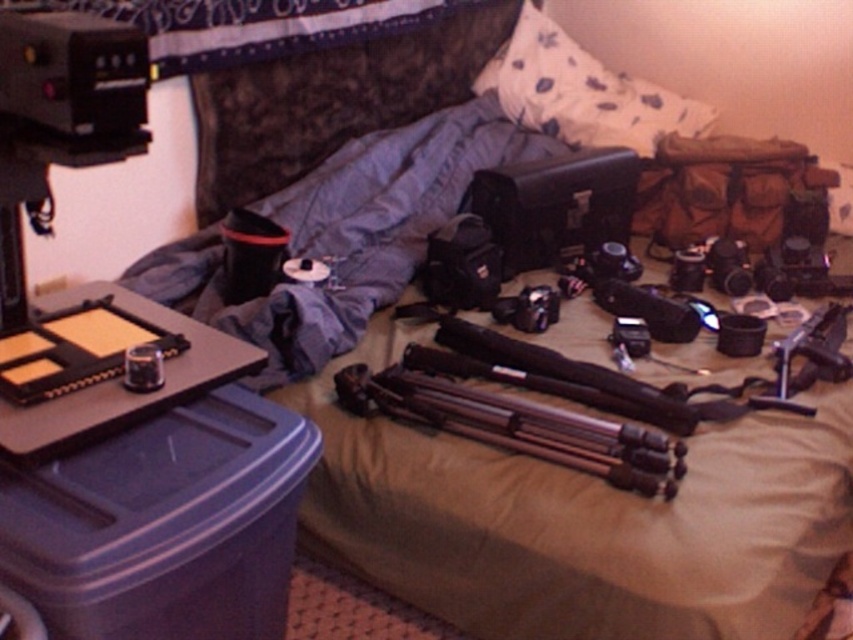
Does point (514, 432) come closer to viewer compared to point (548, 70)?

Yes, it is in front of point (548, 70).

Based on the photo, which is below, silver metallic tripod at center or white floral fabric pillow at upper center?

silver metallic tripod at center is below.

Who is more distant from viewer, (334, 380) or (666, 99)?

The point (666, 99) is behind.

You are a GUI agent. You are given a task and a screenshot of the screen. Output one action in this format:
    pyautogui.click(x=<x>, y=<y>)
    Task: Click on the silver metallic tripod at center
    The width and height of the screenshot is (853, 640).
    Given the screenshot: What is the action you would take?
    pyautogui.click(x=517, y=426)